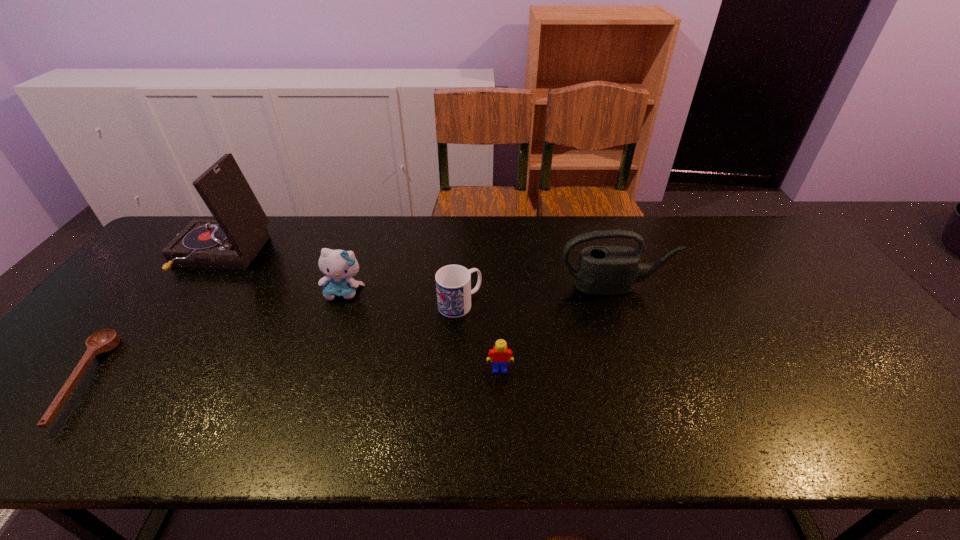
Locate an element on the screen. free point between the shortest object and the mug is located at coordinates (271, 342).

This screenshot has height=540, width=960. Find the location of `vacant area between the Lego and the tallest object`. vacant area between the Lego and the tallest object is located at coordinates (360, 313).

The width and height of the screenshot is (960, 540). In order to click on vacant region between the tallest object and the second tallest object in this screenshot , I will do `click(418, 272)`.

The height and width of the screenshot is (540, 960). I want to click on blank region between the Lego and the tallest object, so click(360, 313).

Image resolution: width=960 pixels, height=540 pixels. I want to click on free spot between the wooden spoon and the phonograph record, so click(151, 319).

This screenshot has height=540, width=960. I want to click on the second closest object to the shortest object, so click(339, 265).

The height and width of the screenshot is (540, 960). Find the location of `the fourth closest object relative to the watering can`. the fourth closest object relative to the watering can is located at coordinates (231, 241).